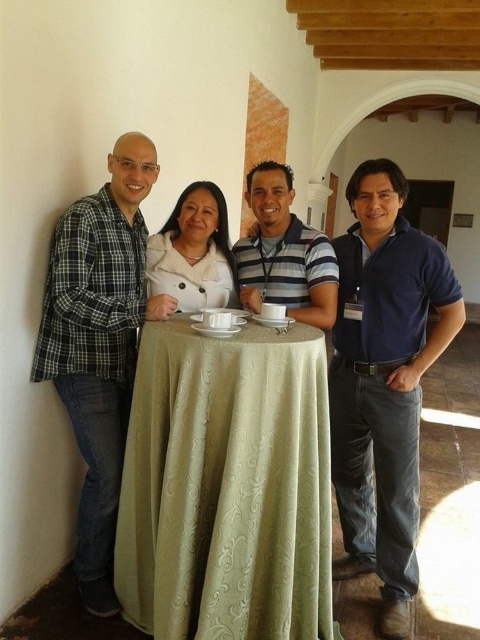
Is point (242, 294) farther from camera compared to point (288, 244)?

That is False.

Does matte white shirt at center have a lesser width compared to striped cotton shirt at center?

No.

Between point (289, 179) and point (314, 317), which one is positioned in front?

Point (314, 317) is in front.

Locate an element on the screen. The width and height of the screenshot is (480, 640). matte white shirt at center is located at coordinates (96, 481).

Does matte white shirt at center appear on the left side of white textured sweater at center?

No, matte white shirt at center is not to the left of white textured sweater at center.

Is matte white shirt at center behind white textured sweater at center?

No, it is not.

Image resolution: width=480 pixels, height=640 pixels. What do you see at coordinates (96, 481) in the screenshot?
I see `matte white shirt at center` at bounding box center [96, 481].

This screenshot has height=640, width=480. I want to click on matte white shirt at center, so click(96, 481).

Identify the location of green textured tablecloth at center. (227, 486).